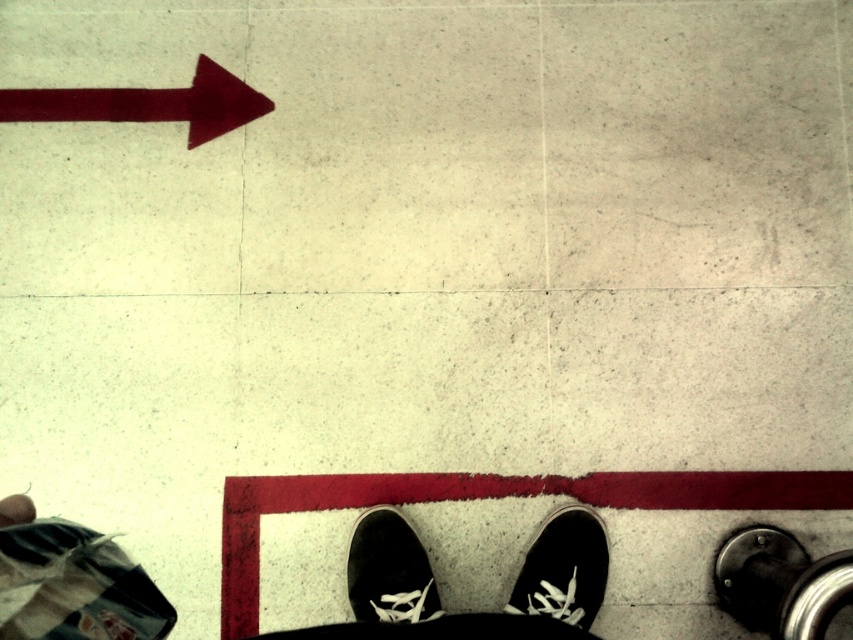
Question: Among these points, which one is nearest to the camera?

Choices:
 (A) (177, 93)
 (B) (398, 584)
 (C) (598, 520)

Answer: (B)

Question: Does matte red arrow at upper left have a greater width compared to black suede shoe at lower center?

Choices:
 (A) yes
 (B) no

Answer: (A)

Question: Can you confirm if matte red arrow at upper left is bigger than black suede shoe at lower center?

Choices:
 (A) yes
 (B) no

Answer: (A)

Question: Which point is closer to the camera?

Choices:
 (A) (595, 525)
 (B) (398, 522)
 (C) (18, 116)

Answer: (A)

Question: Among these points, which one is nearest to the camera?

Choices:
 (A) (49, 100)
 (B) (546, 548)
 (C) (397, 579)

Answer: (C)

Question: Does black canvas shoe at lower center have a lesser width compared to black suede shoe at lower center?

Choices:
 (A) yes
 (B) no

Answer: (B)